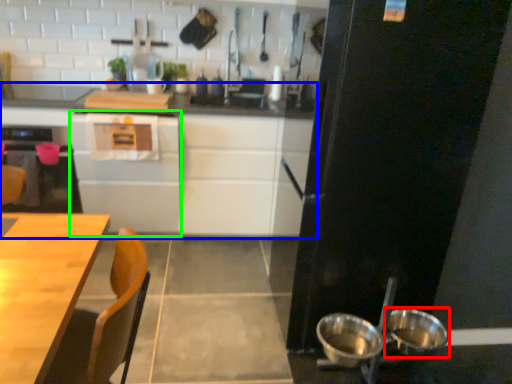
Question: Considering the real-world distances, which object is closest to bowl (highlighted by a red box)? cabinetry (highlighted by a blue box) or cabinetry (highlighted by a green box).

Choices:
 (A) cabinetry
 (B) cabinetry

Answer: (A)